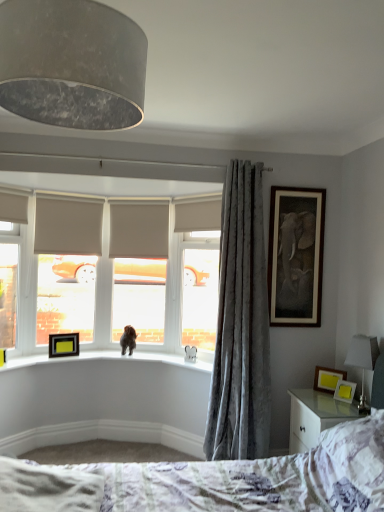
Question: Is wooden photo frame at right, acting as the 2th picture frame starting from the bottom, thinner than matte yellow picture frame at lower right, which appears as the first picture frame when viewed from the right?

Choices:
 (A) no
 (B) yes

Answer: (B)

Question: Considering the relative sizes of wooden photo frame at right, marked as the 3th picture frame in a left-to-right arrangement, and matte yellow picture frame at lower right, which is the fourth picture frame from back to front, in the image provided, is wooden photo frame at right, marked as the 3th picture frame in a left-to-right arrangement, wider than matte yellow picture frame at lower right, which is the fourth picture frame from back to front,?

Choices:
 (A) yes
 (B) no

Answer: (B)

Question: Does wooden photo frame at right, which appears as the 2th picture frame when viewed from the right, have a smaller size compared to matte yellow picture frame at lower right, which is the fourth picture frame from back to front?

Choices:
 (A) no
 (B) yes

Answer: (A)

Question: Considering the relative positions of wooden photo frame at right, placed as the third picture frame when sorted from top to bottom, and matte yellow picture frame at lower right, which is the fourth picture frame from back to front, in the image provided, is wooden photo frame at right, placed as the third picture frame when sorted from top to bottom, in front of matte yellow picture frame at lower right, which is the fourth picture frame from back to front,?

Choices:
 (A) no
 (B) yes

Answer: (A)

Question: Could you tell me if wooden photo frame at right, which is the second picture frame in front-to-back order, is turned towards matte yellow picture frame at lower right, which appears as the first picture frame when viewed from the right?

Choices:
 (A) no
 (B) yes

Answer: (B)

Question: Is wooden photo frame at right, which is the second picture frame in front-to-back order, positioned with its back to matte yellow picture frame at lower right, the first picture frame when ordered from front to back?

Choices:
 (A) yes
 (B) no

Answer: (B)

Question: From the image's perspective, is matte yellow picture frame at lower right, the fourth picture frame from the left, below velvet gray curtain at right?

Choices:
 (A) no
 (B) yes

Answer: (B)

Question: Considering the relative sizes of matte yellow picture frame at lower right, which appears as the first picture frame when viewed from the right, and velvet gray curtain at right in the image provided, is matte yellow picture frame at lower right, which appears as the first picture frame when viewed from the right, smaller than velvet gray curtain at right?

Choices:
 (A) no
 (B) yes

Answer: (B)

Question: From the image's perspective, would you say matte yellow picture frame at lower right, which is the fourth picture frame from back to front, is positioned over velvet gray curtain at right?

Choices:
 (A) no
 (B) yes

Answer: (A)

Question: Is matte yellow picture frame at lower right, the first picture frame when ordered from front to back, shorter than velvet gray curtain at right?

Choices:
 (A) no
 (B) yes

Answer: (B)

Question: Is velvet gray curtain at right surrounded by matte yellow picture frame at lower right, the fourth picture frame from the left?

Choices:
 (A) no
 (B) yes

Answer: (A)

Question: Is matte yellow picture frame at lower right, the first picture frame when ordered from front to back, positioned before velvet gray curtain at right?

Choices:
 (A) no
 (B) yes

Answer: (A)

Question: From a real-world perspective, is matte gray roller blind at center, the 1th window screen viewed from the right, beneath wooden photo frame at right, marked as the 3th picture frame in a left-to-right arrangement?

Choices:
 (A) yes
 (B) no

Answer: (B)